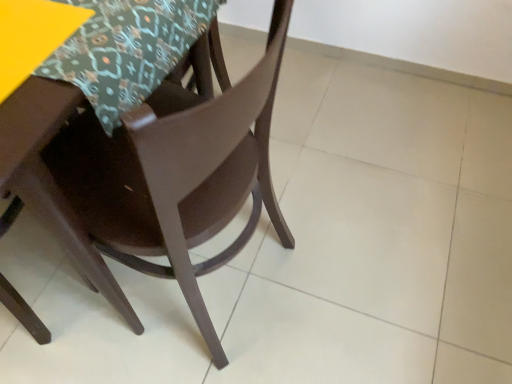
Question: Is matte brown chair at center oriented towards yellow matte table at upper left?

Choices:
 (A) no
 (B) yes

Answer: (B)

Question: Can you confirm if matte brown chair at center is positioned to the left of yellow matte table at upper left?

Choices:
 (A) yes
 (B) no

Answer: (B)

Question: From the image's perspective, is matte brown chair at center below yellow matte table at upper left?

Choices:
 (A) no
 (B) yes

Answer: (B)

Question: Can you confirm if matte brown chair at center is positioned to the right of yellow matte table at upper left?

Choices:
 (A) no
 (B) yes

Answer: (B)

Question: Is matte brown chair at center beside yellow matte table at upper left?

Choices:
 (A) no
 (B) yes

Answer: (A)

Question: Considering the relative positions of patterned fabric tablecloth at upper left and matte brown chair at center in the image provided, is patterned fabric tablecloth at upper left to the left or to the right of matte brown chair at center?

Choices:
 (A) right
 (B) left

Answer: (B)

Question: Is patterned fabric tablecloth at upper left in front of or behind matte brown chair at center in the image?

Choices:
 (A) behind
 (B) front

Answer: (A)

Question: From the image's perspective, relative to matte brown chair at center, is patterned fabric tablecloth at upper left above or below?

Choices:
 (A) above
 (B) below

Answer: (A)

Question: Choose the correct answer: Is patterned fabric tablecloth at upper left inside matte brown chair at center or outside it?

Choices:
 (A) inside
 (B) outside

Answer: (A)

Question: Is yellow matte table at upper left taller or shorter than patterned fabric tablecloth at upper left?

Choices:
 (A) short
 (B) tall

Answer: (A)

Question: Is yellow matte table at upper left wider or thinner than patterned fabric tablecloth at upper left?

Choices:
 (A) thin
 (B) wide

Answer: (A)

Question: Based on their sizes in the image, would you say yellow matte table at upper left is bigger or smaller than patterned fabric tablecloth at upper left?

Choices:
 (A) big
 (B) small

Answer: (B)

Question: Is point (12, 77) closer or farther from the camera than point (164, 59)?

Choices:
 (A) closer
 (B) farther

Answer: (A)

Question: Considering the positions of point (89, 130) and point (30, 11), is point (89, 130) closer or farther from the camera than point (30, 11)?

Choices:
 (A) farther
 (B) closer

Answer: (A)

Question: Considering the positions of matte brown chair at center and yellow matte table at upper left in the image, is matte brown chair at center taller or shorter than yellow matte table at upper left?

Choices:
 (A) short
 (B) tall

Answer: (B)